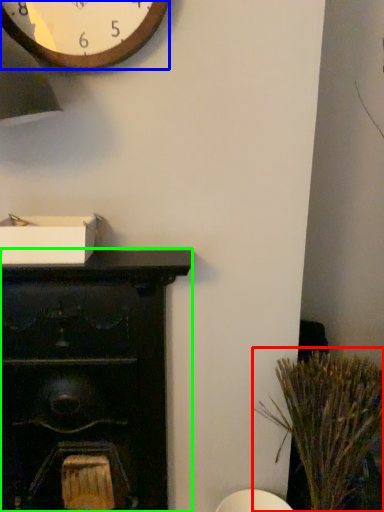
Question: Which object is positioned closest to plant (highlighted by a red box)? Select from wall clock (highlighted by a blue box) and furniture (highlighted by a green box).

Choices:
 (A) wall clock
 (B) furniture

Answer: (B)